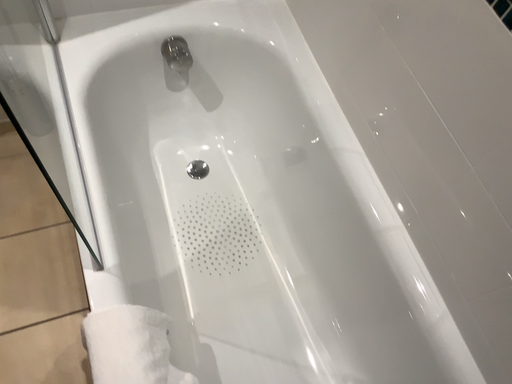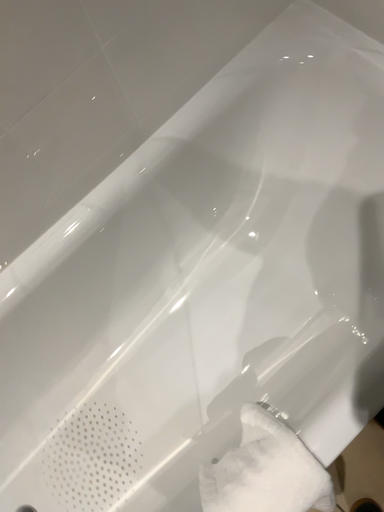
Question: Which way did the camera rotate in the video?

Choices:
 (A) rotated left
 (B) rotated right

Answer: (B)